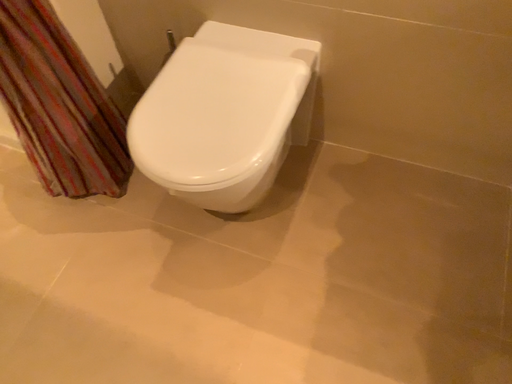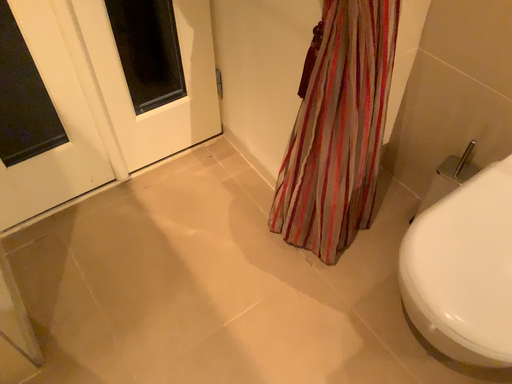
Question: How did the camera likely rotate when shooting the video?

Choices:
 (A) rotated left
 (B) rotated right

Answer: (A)